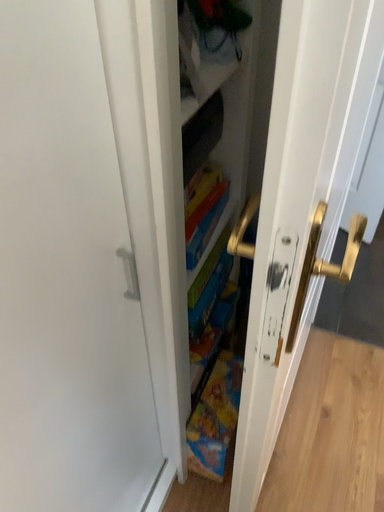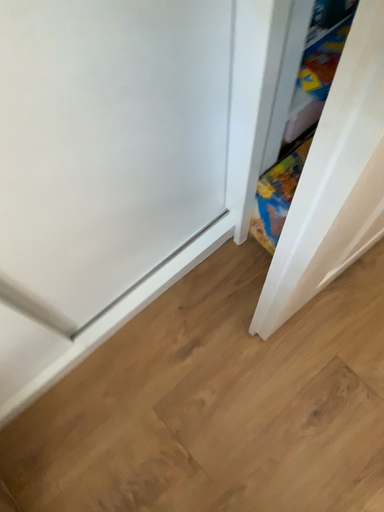
Question: How did the camera likely rotate when shooting the video?

Choices:
 (A) rotated downward
 (B) rotated upward

Answer: (A)